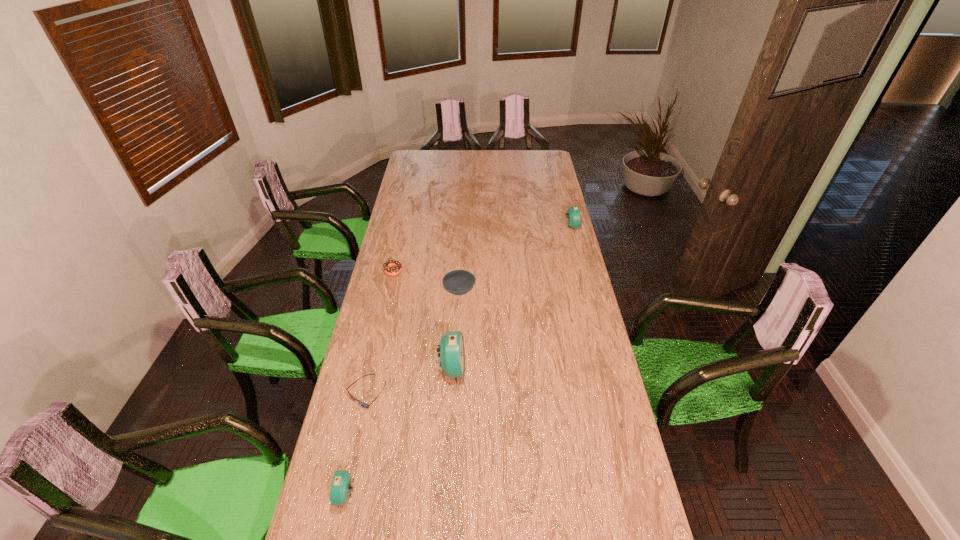
You are a GUI agent. You are given a task and a screenshot of the screen. Output one action in this format:
    pyautogui.click(x=<x>, y=<y>)
    Task: Click on the vacant space that is in between the tallest alarm clock and the sunglasses
    The image size is (960, 540).
    Given the screenshot: What is the action you would take?
    (x=409, y=381)

Where is `unoccupied position between the second farthest object and the second alarm clock from right to left`? unoccupied position between the second farthest object and the second alarm clock from right to left is located at coordinates (422, 320).

Identify the location of unoccupied area between the sunglasses and the nearest object. (356, 444).

The height and width of the screenshot is (540, 960). I want to click on blank region between the tallest object and the second tallest alarm clock, so click(x=512, y=298).

You are a GUI agent. You are given a task and a screenshot of the screen. Output one action in this format:
    pyautogui.click(x=<x>, y=<y>)
    Task: Click on the vacant area that lies between the farthest alarm clock and the tallest object
    This screenshot has width=960, height=540.
    Given the screenshot: What is the action you would take?
    pyautogui.click(x=512, y=298)

Find the location of a particular element. empty space that is in between the tallest alarm clock and the third farthest object is located at coordinates (456, 330).

You are a GUI agent. You are given a task and a screenshot of the screen. Output one action in this format:
    pyautogui.click(x=<x>, y=<y>)
    Task: Click on the object that is the third closest to the fifth nearest object
    
    Given the screenshot: What is the action you would take?
    pyautogui.click(x=365, y=405)

Identify which object is the fifth closest to the sunglasses. Please provide its 2D coordinates. Your answer should be formatted as a tuple, i.e. [(x, y)], where the tuple contains the x and y coordinates of a point satisfying the conditions above.

[(573, 213)]

Where is `alarm clock that stands as the second closest to the second farthest alarm clock`? This screenshot has width=960, height=540. alarm clock that stands as the second closest to the second farthest alarm clock is located at coordinates click(573, 213).

Find the location of a particular element. This screenshot has height=540, width=960. alarm clock object that ranks as the second closest to the fourth nearest object is located at coordinates (573, 213).